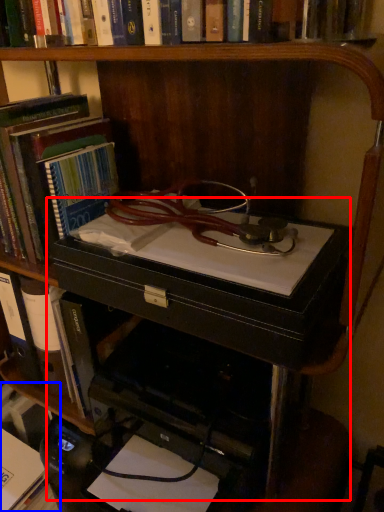
Question: Which object is further to the camera taking this photo, computer desk (highlighted by a red box) or book (highlighted by a blue box)?

Choices:
 (A) computer desk
 (B) book

Answer: (B)